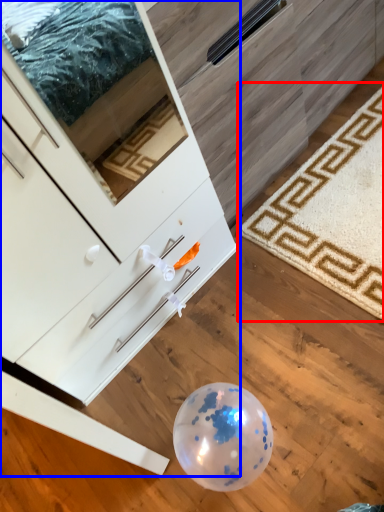
Question: Among these objects, which one is nearest to the camera, mat (highlighted by a red box) or chest of drawers (highlighted by a blue box)?

Choices:
 (A) mat
 (B) chest of drawers

Answer: (B)